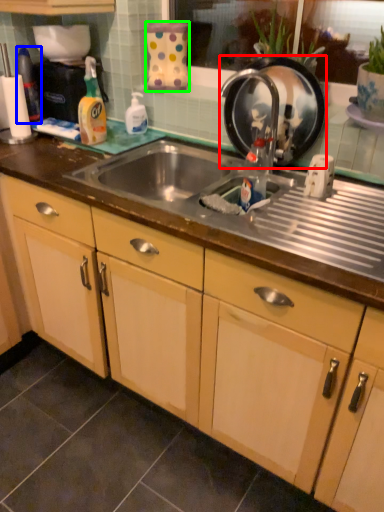
Question: Which object is the closest to the appliance (highlighted by a red box)? Choose among these: bottle (highlighted by a blue box) or appliance (highlighted by a green box).

Choices:
 (A) bottle
 (B) appliance

Answer: (B)